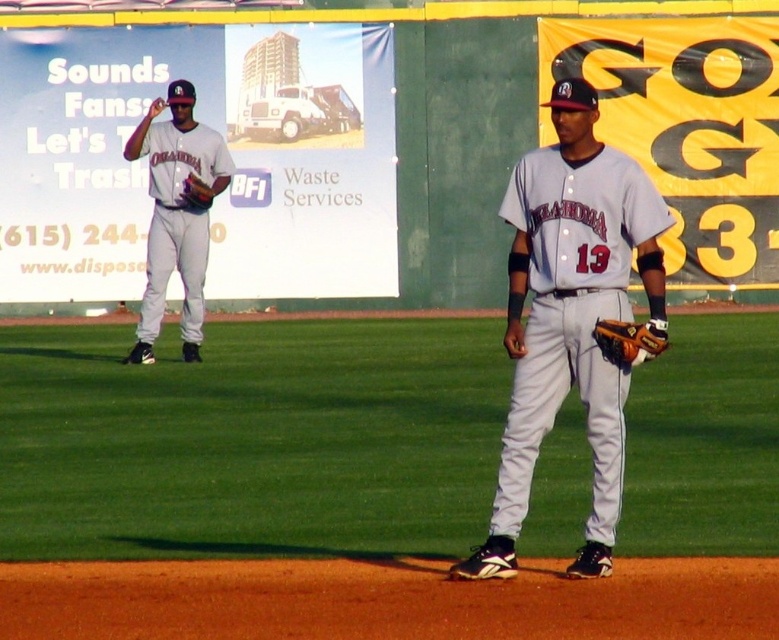
Between point (671, 451) and point (610, 346), which one is positioned behind?

Positioned behind is point (671, 451).

Does white uniform pants at center appear on the left side of brown leather glove at lower right?

Yes, white uniform pants at center is to the left of brown leather glove at lower right.

Who is more forward, (344, 529) or (597, 339)?

Point (597, 339) is in front.

Where is `white uniform pants at center`? Image resolution: width=779 pixels, height=640 pixels. white uniform pants at center is located at coordinates (251, 440).

Which is more to the left, gray fabric baseball uniform at center or matte gray uniform at left?

From the viewer's perspective, matte gray uniform at left appears more on the left side.

Is point (582, 84) in front of point (210, 184)?

Yes, point (582, 84) is closer to viewer.

Identify the location of gray fabric baseball uniform at center. (569, 317).

Who is higher up, white uniform pants at center or brown leather glove at left?

brown leather glove at left is higher up.

Who is more forward, (663, 433) or (189, 198)?

Point (663, 433) is more forward.

In order to click on white uniform pants at center in this screenshot , I will do `click(251, 440)`.